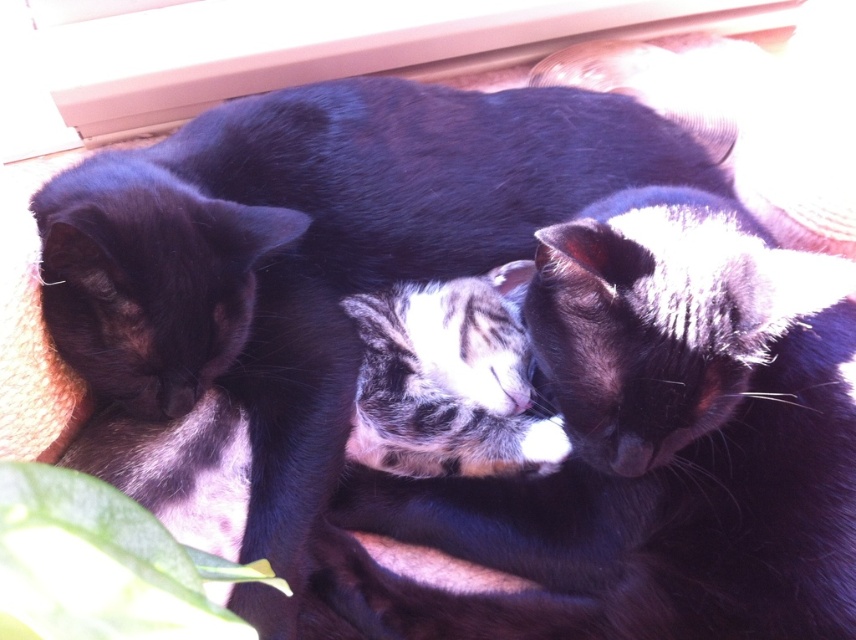
Is point (345, 67) less distant than point (70, 474)?

No.

Where is `smooth wood window sill at upper center`? smooth wood window sill at upper center is located at coordinates (331, 45).